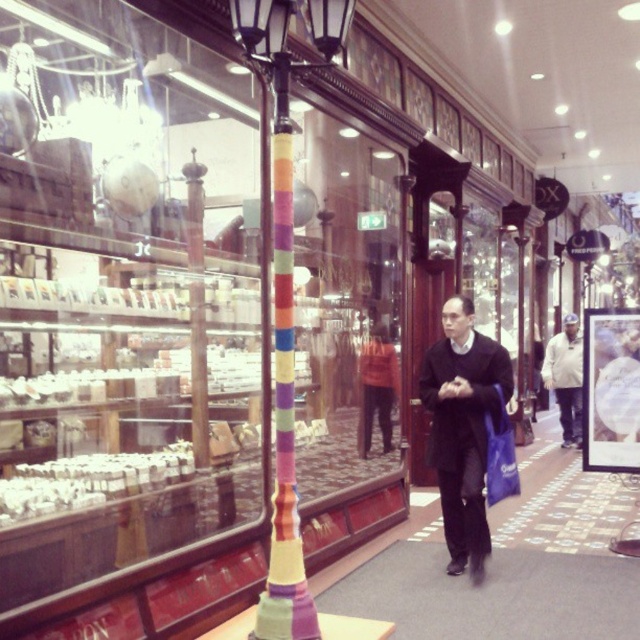
You are a customer in the store and want to walk from the entrance to the display case. You see the multicolored fabric pole at center and the carpeted floor at center. Which object will you step on first?

The carpeted floor at center is under the multicolored fabric pole at center, so you will step on the carpeted floor at center first before reaching the multicolored fabric pole at center.

You are standing in the department store and want to place a small potted plant exactly at the center of the carpeted floor at center. According to the image, what are the coordinates where you should place the plant?

The coordinates for the carpeted floor at center are point (492, 595), so you should place the plant there.